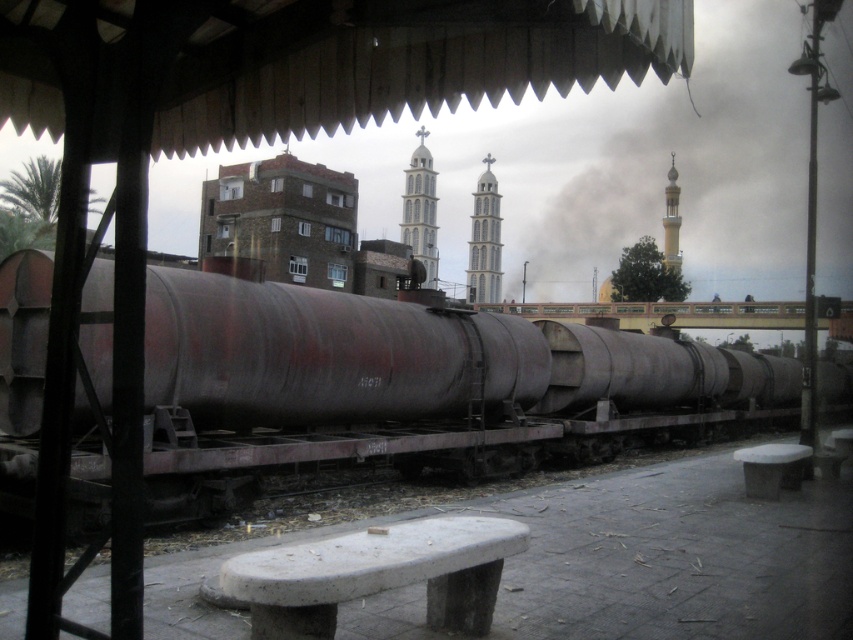
From the picture: You are a city planner analyzing the urban layout. Given the white glass tower at center and the white stone tower at center, which one has a greater width?

The white glass tower at center has a greater width than the white stone tower at center.

You are a tourist standing in the urban scene and want to take a photo of both the white glass tower at center and the white stone tower at center. However, you notice that one is blocking the view of the other. Which tower should you move closer to in order to capture both in your photo?

The white stone tower at center is behind the white glass tower at center. To capture both in your photo, you should move closer to the white glass tower at center so that the white stone tower at center becomes visible behind it.